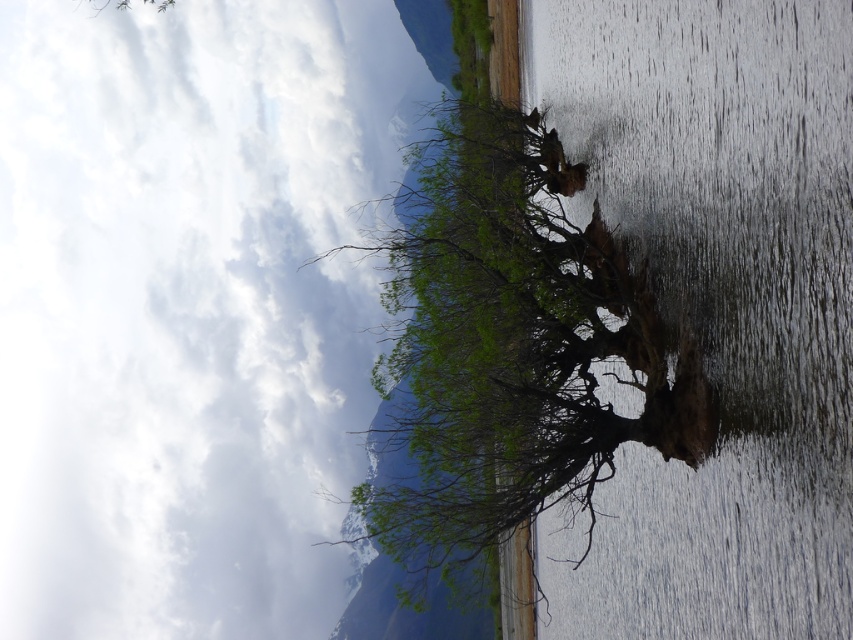
Question: Which point is closer to the camera?

Choices:
 (A) (480, 380)
 (B) (212, 620)

Answer: (A)

Question: Which of the following is the closest to the observer?

Choices:
 (A) green leafy tree at upper center
 (B) brown rough tree trunk at center
 (C) green leafy tree at center

Answer: (B)

Question: Is green leafy tree at upper center closer to the viewer compared to brown rough tree trunk at center?

Choices:
 (A) no
 (B) yes

Answer: (A)

Question: Can you confirm if brown rough tree trunk at center is smaller than green leafy tree at center?

Choices:
 (A) no
 (B) yes

Answer: (B)

Question: Which of the following is the farthest from the observer?

Choices:
 (A) green leafy tree at upper center
 (B) brown rough tree trunk at center
 (C) green leafy tree at center

Answer: (A)

Question: Can you confirm if brown rough tree trunk at center is thinner than green leafy tree at center?

Choices:
 (A) no
 (B) yes

Answer: (B)